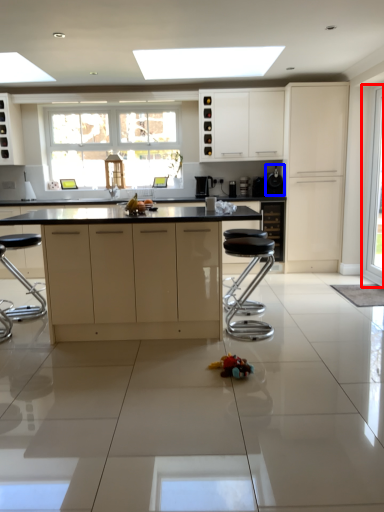
Question: Which point is closer to the camera, glass door (highlighted by a red box) or appliance (highlighted by a blue box)?

Choices:
 (A) glass door
 (B) appliance

Answer: (A)